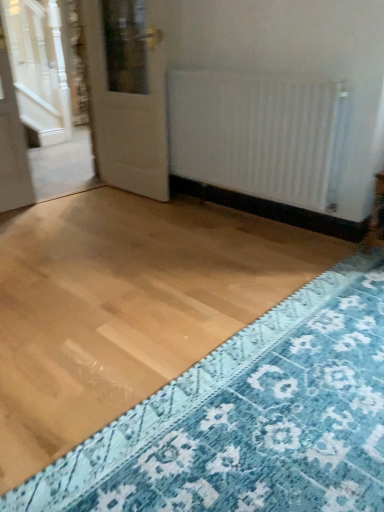
You are a GUI agent. You are given a task and a screenshot of the screen. Output one action in this format:
    pyautogui.click(x=<x>, y=<y>)
    Task: Click on the vacant area that is in front of white glossy door at upper left
    
    Given the screenshot: What is the action you would take?
    pyautogui.click(x=125, y=211)